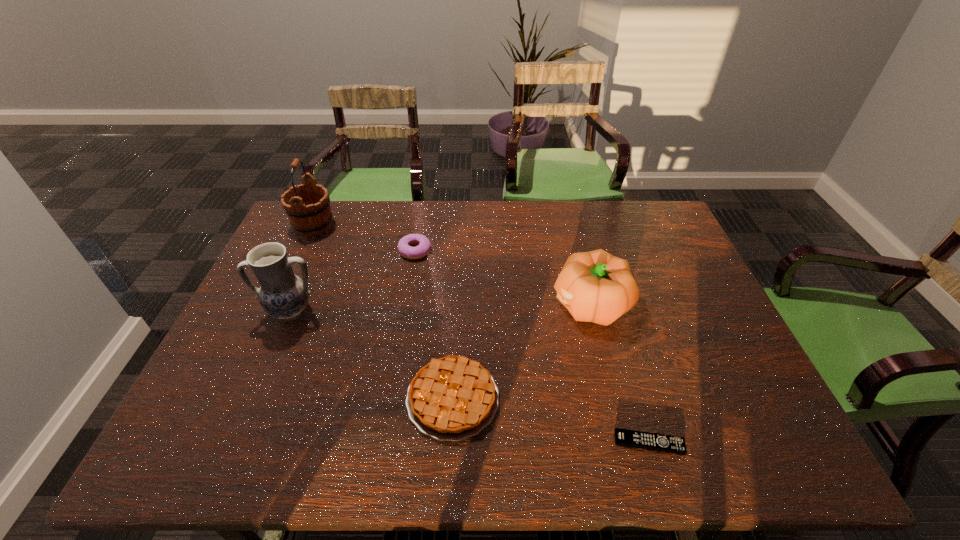
Find the location of `wine bucket`. wine bucket is located at coordinates (309, 216).

At what (x,y) coordinates should I click in order to perform the action: click on pottery. Please return your answer as a coordinate pair (x, y). This screenshot has width=960, height=540. Looking at the image, I should click on (282, 294).

Image resolution: width=960 pixels, height=540 pixels. Identify the location of the fourth shortest object. (595, 286).

At what (x,y) coordinates should I click in order to perform the action: click on doughnut. Please return your answer as a coordinate pair (x, y). This screenshot has height=540, width=960. Looking at the image, I should click on (424, 245).

Identify the location of pie. The image size is (960, 540). (452, 398).

The image size is (960, 540). Find the location of `the shortest object`. the shortest object is located at coordinates click(623, 437).

Find the location of a particular element. free space located on the right of the wine bucket is located at coordinates (386, 226).

Where is `vacant area located 0.250m on the front of the second tallest object`? Image resolution: width=960 pixels, height=540 pixels. vacant area located 0.250m on the front of the second tallest object is located at coordinates (248, 414).

Where is `vacant space located on the carved face of the third tallest object`? This screenshot has width=960, height=540. vacant space located on the carved face of the third tallest object is located at coordinates (419, 304).

Find the location of a particular element. free space located 0.060m on the carved face of the third tallest object is located at coordinates (530, 304).